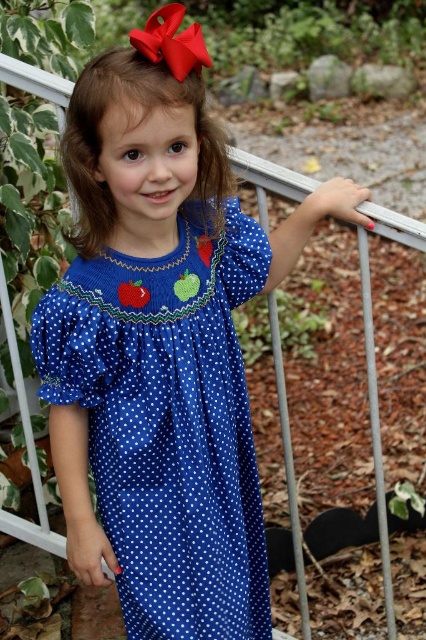
Is brown silky hair at upper center below red satin bow at upper center?

Correct, brown silky hair at upper center is located below red satin bow at upper center.

How far apart are brown silky hair at upper center and red satin bow at upper center?

A distance of 17.24 centimeters exists between brown silky hair at upper center and red satin bow at upper center.

Find the location of a particular element. The height and width of the screenshot is (640, 426). brown silky hair at upper center is located at coordinates (143, 116).

Between blue polka dot dress at center and red satin bow at upper center, which one has less height?

With less height is red satin bow at upper center.

Who is positioned more to the right, blue polka dot dress at center or red satin bow at upper center?

blue polka dot dress at center

Does point (120, 298) come behind point (187, 70)?

Yes, point (120, 298) is farther from viewer.

Find the location of a particular element. This screenshot has height=640, width=426. blue polka dot dress at center is located at coordinates (169, 422).

Locate an element on the screen. The width and height of the screenshot is (426, 640). blue polka dot dress at center is located at coordinates point(169,422).